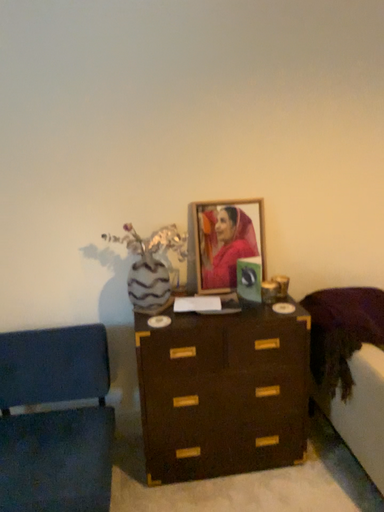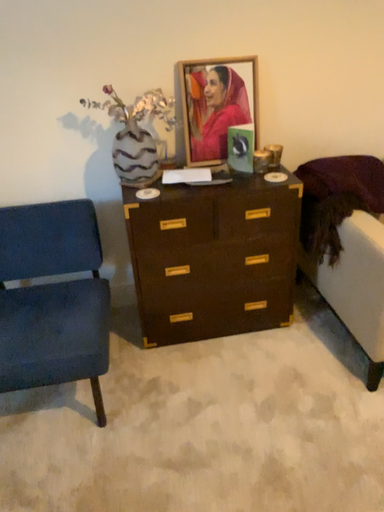
Question: Which way did the camera rotate in the video?

Choices:
 (A) rotated upward
 (B) rotated downward

Answer: (B)